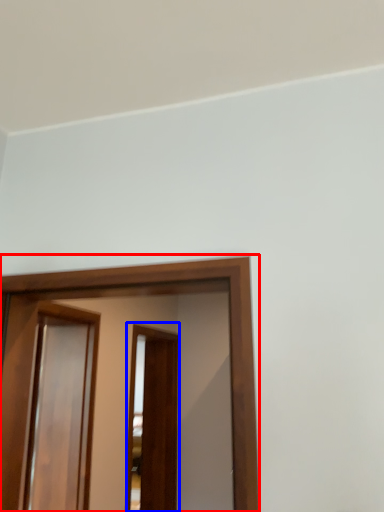
Question: Which object appears closest to the camera in this image, screen door (highlighted by a red box) or screen door (highlighted by a blue box)?

Choices:
 (A) screen door
 (B) screen door

Answer: (A)